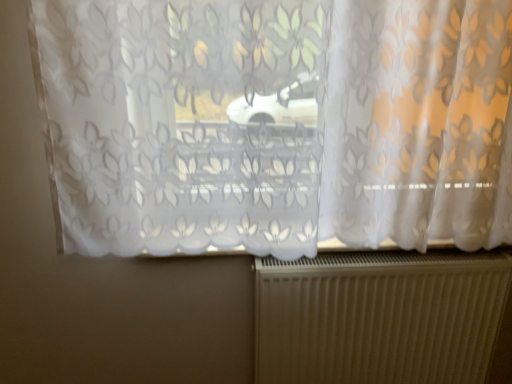
Question: Should I look upward or downward to see translucent floral-patterned curtain at center?

Choices:
 (A) down
 (B) up

Answer: (B)

Question: Are metallic ribbed radiator at bottom and translucent floral-patterned curtain at center beside each other?

Choices:
 (A) yes
 (B) no

Answer: (B)

Question: Can you confirm if metallic ribbed radiator at bottom is shorter than translucent floral-patterned curtain at center?

Choices:
 (A) no
 (B) yes

Answer: (B)

Question: From a real-world perspective, does metallic ribbed radiator at bottom stand above translucent floral-patterned curtain at center?

Choices:
 (A) yes
 (B) no

Answer: (B)

Question: Does metallic ribbed radiator at bottom have a greater height compared to translucent floral-patterned curtain at center?

Choices:
 (A) yes
 (B) no

Answer: (B)

Question: Considering the relative positions of metallic ribbed radiator at bottom and translucent floral-patterned curtain at center in the image provided, is metallic ribbed radiator at bottom in front of translucent floral-patterned curtain at center?

Choices:
 (A) yes
 (B) no

Answer: (B)

Question: Would you say translucent floral-patterned curtain at center is part of metallic ribbed radiator at bottom's contents?

Choices:
 (A) no
 (B) yes

Answer: (A)

Question: Is translucent floral-patterned curtain at center positioned far away from metallic ribbed radiator at bottom?

Choices:
 (A) no
 (B) yes

Answer: (A)

Question: Is translucent floral-patterned curtain at center turned away from metallic ribbed radiator at bottom?

Choices:
 (A) no
 (B) yes

Answer: (A)

Question: From the image's perspective, is translucent floral-patterned curtain at center located above metallic ribbed radiator at bottom?

Choices:
 (A) yes
 (B) no

Answer: (A)

Question: Can you confirm if translucent floral-patterned curtain at center is wider than metallic ribbed radiator at bottom?

Choices:
 (A) yes
 (B) no

Answer: (A)

Question: Does translucent floral-patterned curtain at center have a larger size compared to metallic ribbed radiator at bottom?

Choices:
 (A) no
 (B) yes

Answer: (B)

Question: Does translucent floral-patterned curtain at center have a greater height compared to metallic ribbed radiator at bottom?

Choices:
 (A) no
 (B) yes

Answer: (B)

Question: From the image's perspective, relative to translucent floral-patterned curtain at center, is metallic ribbed radiator at bottom above or below?

Choices:
 (A) above
 (B) below

Answer: (B)